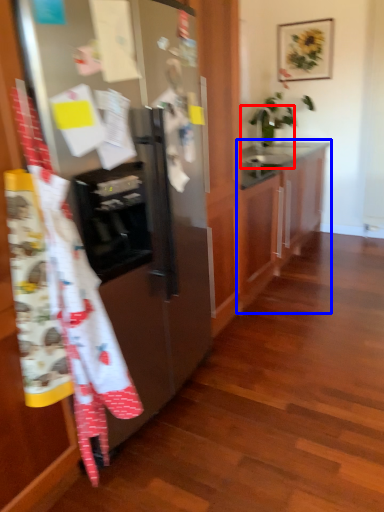
Question: Which point is closer to the camera, sink (highlighted by a red box) or cabinetry (highlighted by a blue box)?

Choices:
 (A) sink
 (B) cabinetry

Answer: (B)